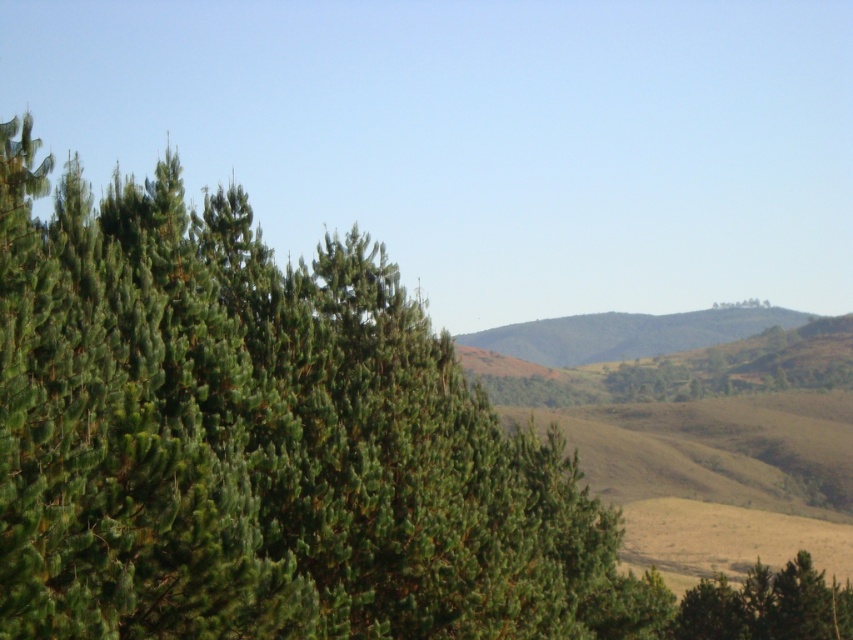
Question: Is green needle-like at left in front of green textured tree at lower right?

Choices:
 (A) yes
 (B) no

Answer: (A)

Question: Observing the image, what is the correct spatial positioning of green needle-like at left in reference to green textured tree at lower right?

Choices:
 (A) above
 (B) below

Answer: (A)

Question: Is green needle-like at left above green textured tree at lower right?

Choices:
 (A) yes
 (B) no

Answer: (A)

Question: Which point is farther from the camera taking this photo?

Choices:
 (A) [761, 582]
 (B) [605, 541]

Answer: (A)

Question: Which of the following is the farthest from the observer?

Choices:
 (A) (381, 476)
 (B) (849, 630)

Answer: (B)